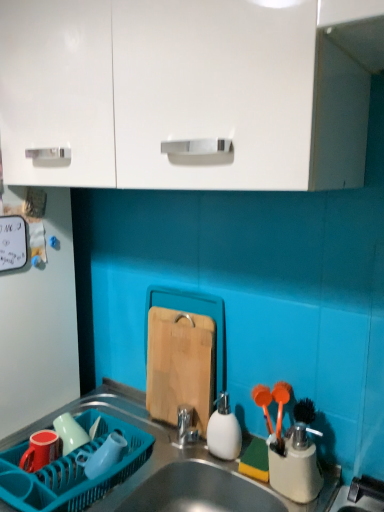
Question: Is matte ceramic mug at lower left, the 1th tableware from the left, far away from metallic stainless steel sink at lower center?

Choices:
 (A) no
 (B) yes

Answer: (A)

Question: Is matte ceramic mug at lower left, the 1th tableware from the left, surrounding metallic stainless steel sink at lower center?

Choices:
 (A) no
 (B) yes

Answer: (A)

Question: Is matte ceramic mug at lower left, the 1th tableware from the left, shorter than metallic stainless steel sink at lower center?

Choices:
 (A) no
 (B) yes

Answer: (B)

Question: Can you confirm if matte ceramic mug at lower left, the 4th tableware positioned from the right, is wider than metallic stainless steel sink at lower center?

Choices:
 (A) no
 (B) yes

Answer: (A)

Question: Is matte ceramic mug at lower left, the 1th tableware from the left, not within metallic stainless steel sink at lower center?

Choices:
 (A) no
 (B) yes

Answer: (A)

Question: Is metallic stainless steel sink at lower center at the back of matte ceramic mug at lower left, the 1th tableware from the left?

Choices:
 (A) yes
 (B) no

Answer: (B)

Question: Considering the relative positions of metallic stainless steel sink at lower center and wooden cutting board at center in the image provided, is metallic stainless steel sink at lower center to the left of wooden cutting board at center from the viewer's perspective?

Choices:
 (A) yes
 (B) no

Answer: (A)

Question: Considering the relative sizes of metallic stainless steel sink at lower center and wooden cutting board at center in the image provided, is metallic stainless steel sink at lower center thinner than wooden cutting board at center?

Choices:
 (A) yes
 (B) no

Answer: (B)

Question: From a real-world perspective, is metallic stainless steel sink at lower center under wooden cutting board at center?

Choices:
 (A) no
 (B) yes

Answer: (B)

Question: Is metallic stainless steel sink at lower center positioned far away from wooden cutting board at center?

Choices:
 (A) yes
 (B) no

Answer: (B)

Question: Can you confirm if metallic stainless steel sink at lower center is smaller than wooden cutting board at center?

Choices:
 (A) yes
 (B) no

Answer: (B)

Question: From the image's perspective, would you say metallic stainless steel sink at lower center is shown under wooden cutting board at center?

Choices:
 (A) yes
 (B) no

Answer: (A)

Question: From a real-world perspective, is translucent blue plastic cup at lower left, positioned as the third tableware in left-to-right order, located higher than teal plastic dish rack at lower left?

Choices:
 (A) yes
 (B) no

Answer: (A)